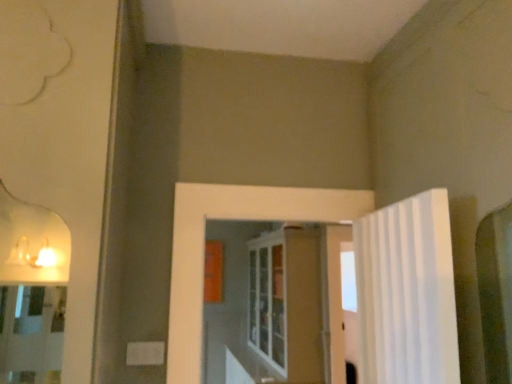
Question: Is white glass cabinet at center bigger or smaller than white striped fabric at right?

Choices:
 (A) big
 (B) small

Answer: (A)

Question: Is point (314, 380) positioned closer to the camera than point (382, 268)?

Choices:
 (A) closer
 (B) farther

Answer: (B)

Question: Considering the positions of white glass cabinet at center and white striped fabric at right in the image, is white glass cabinet at center taller or shorter than white striped fabric at right?

Choices:
 (A) tall
 (B) short

Answer: (A)

Question: From a real-world perspective, is white striped fabric at right positioned above or below white glass cabinet at center?

Choices:
 (A) below
 (B) above

Answer: (B)

Question: Relative to white glass cabinet at center, is white striped fabric at right in front or behind?

Choices:
 (A) front
 (B) behind

Answer: (A)

Question: In the image, is white striped fabric at right on the left side or the right side of white glass cabinet at center?

Choices:
 (A) right
 (B) left

Answer: (A)

Question: In terms of width, does white striped fabric at right look wider or thinner when compared to white glass cabinet at center?

Choices:
 (A) wide
 (B) thin

Answer: (B)